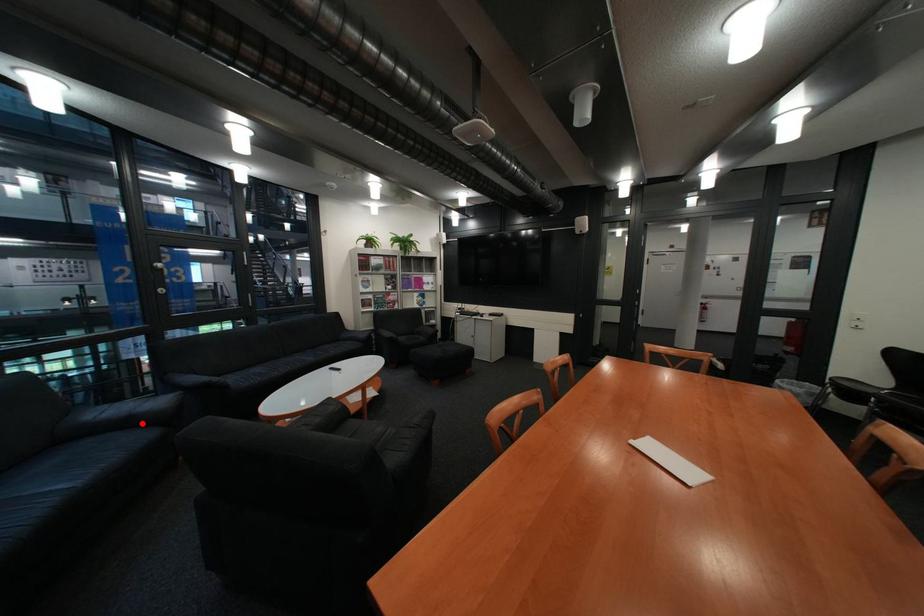
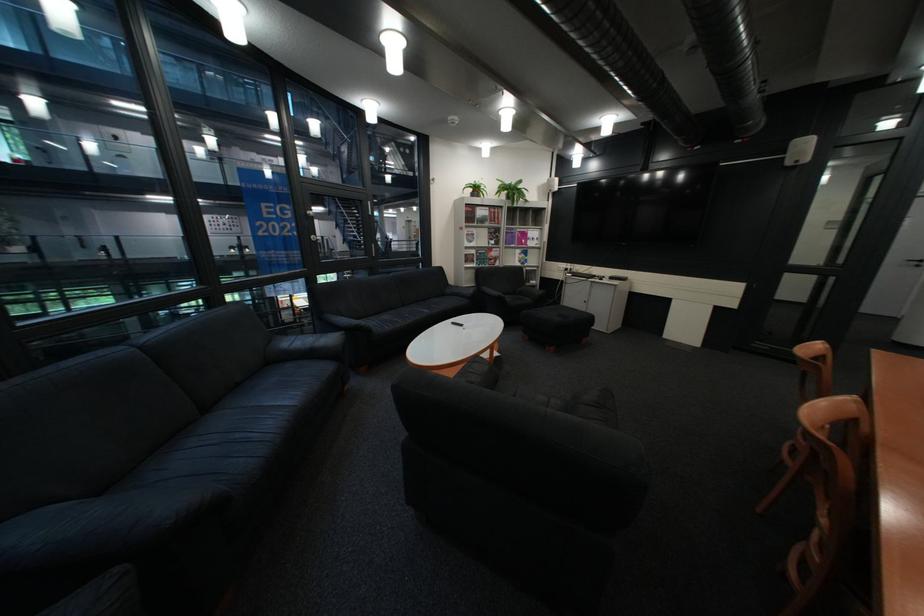
Question: A red point is marked in image1. In image2, is the corresponding 3D point closer to the camera or farther? Reply with the corresponding letter.

Choices:
 (A) The corresponding 3D point is closer.
 (B) The corresponding 3D point is farther.

Answer: (B)